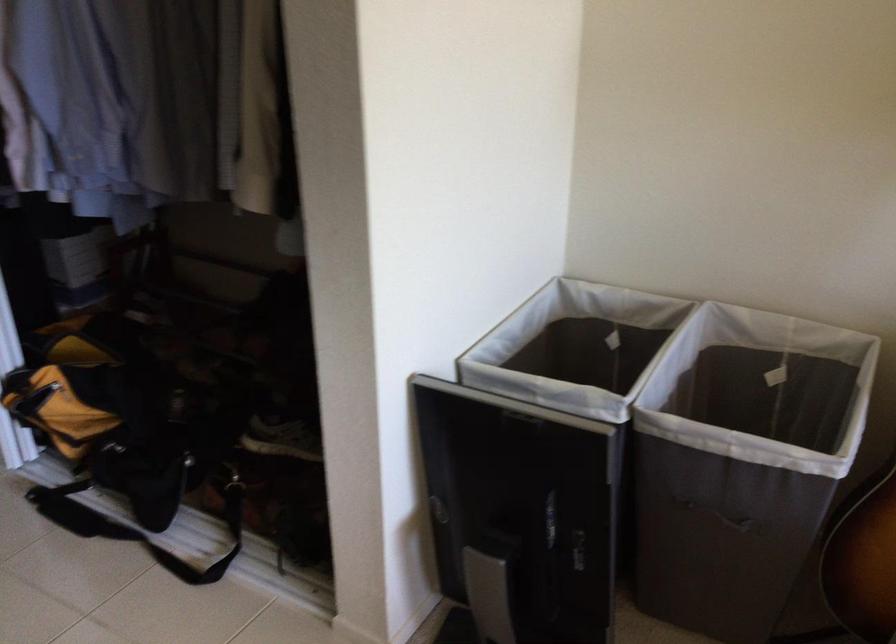
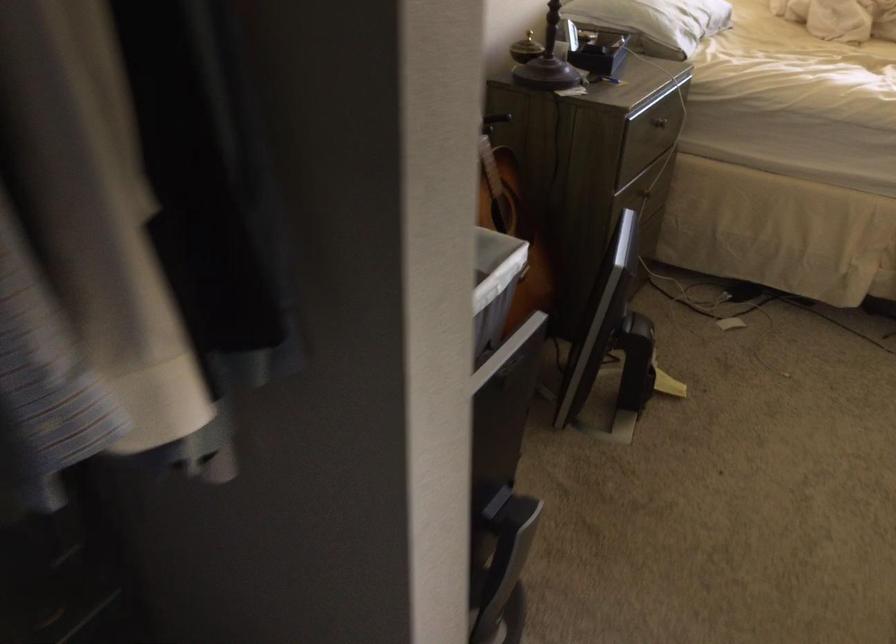
Locate, in the second image, the point that corresponds to the point at 747,440 in the first image.

(494, 286)